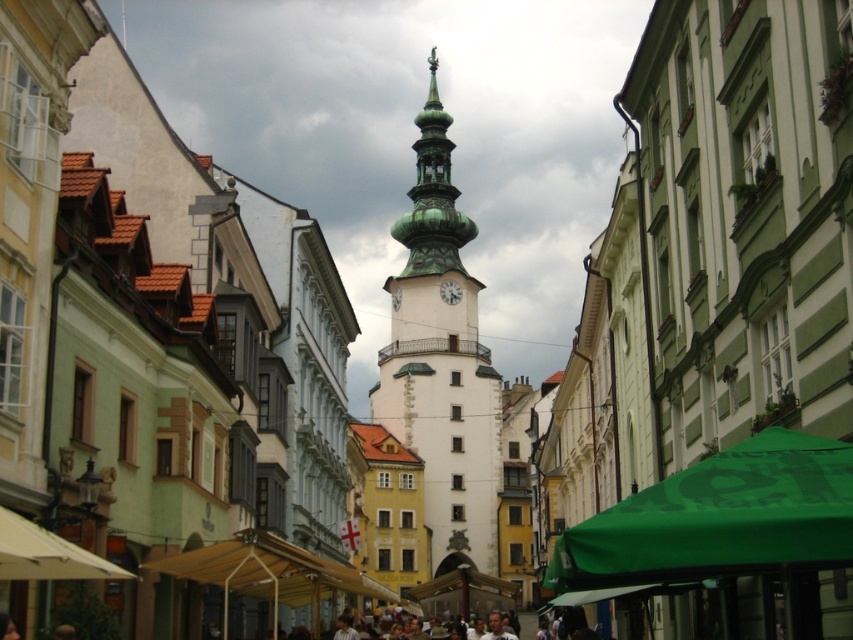
You are a tourist standing on the street looking at the green copper clock tower at center and the yellow fabric canopy at lower center. Which object is closer to you?

The green copper clock tower at center is closer to you because the yellow fabric canopy at lower center is behind it.

You are standing in the historic town square and see the point marked at coordinates (x=268, y=573). Based on the scene description, what object is this point located on?

The point at coordinates (x=268, y=573) is located on the yellow fabric canopy at lower center.

You are standing at the base of the clock tower and notice two points marked on the ground. The first point is at coordinates point (287, 573) and the second is at point (451, 282). Which point is closer to you?

Point (287, 573) is in front of point (451, 282), so it is closer to you.